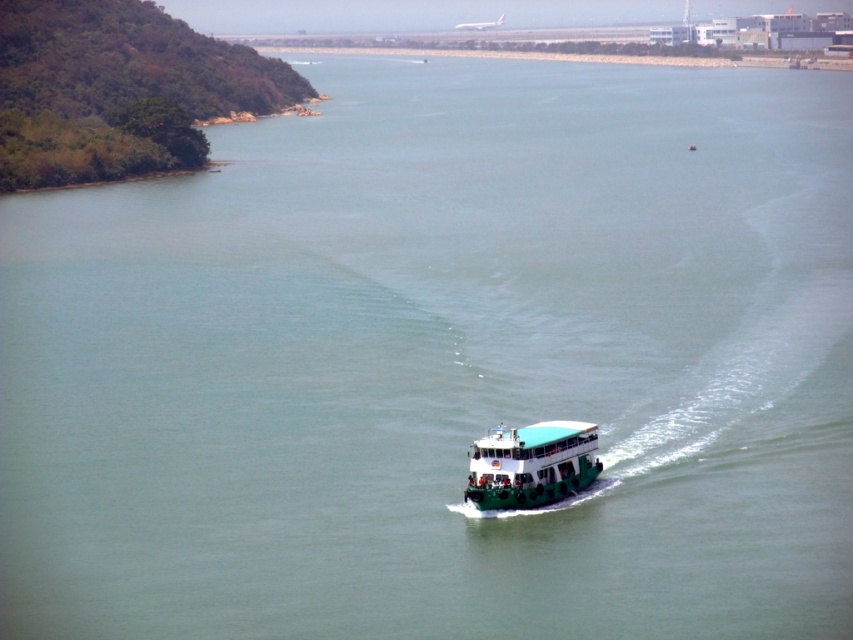
You are a tour guide planning a boat trip. The ferry needs to maintain a safe distance of at least 300 meters from the concrete wall to avoid collision. Can the green matte ferry at center safely navigate its current course without getting too close to the concrete wall at upper center?

The green matte ferry at center and concrete wall at upper center are 352.55 meters apart, which is more than the required 300 meters. Therefore, the ferry can safely navigate its current course without getting too close to the concrete wall at upper center.

You are a passenger on the green matte ferry at center. You want to see the concrete wall at upper center. Can you see it from your current position?

The green matte ferry at center is shorter in height than the concrete wall at upper center, so yes, you can see the concrete wall at upper center from your position on the ferry.